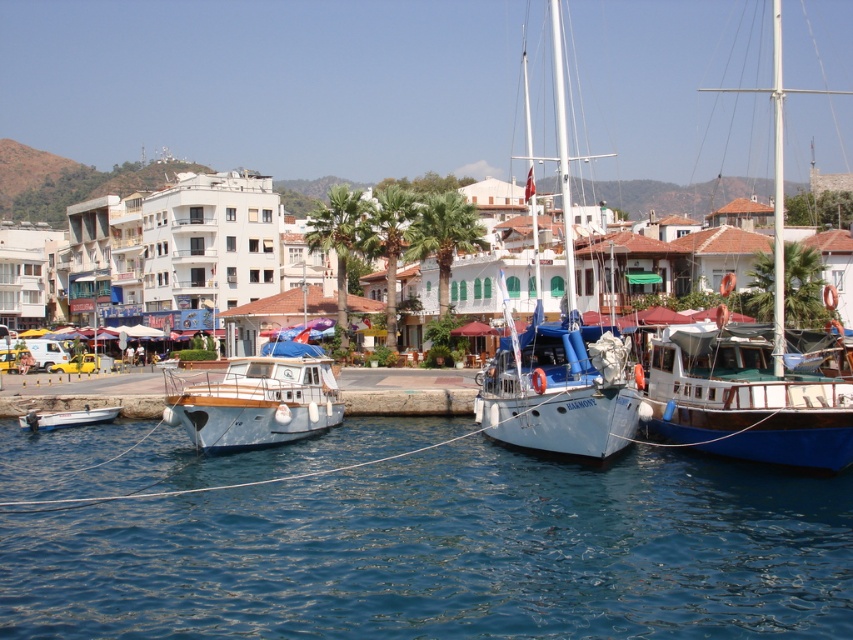
You are a dock worker who needs to move the white wooden boat at right and the matte blue wooden boat at center to a different dock. Based on their sizes, which boat would require more space during the relocation process?

The matte blue wooden boat at center requires more space during relocation because it occupies more space than the white wooden boat at right.

You are a photographer planning to take a photo of the blue polished wood sailboat at center and the white glossy sailboat at center from the pier. Which boat should you position yourself closer to if you want to capture both boats in the frame without moving the camera? Explain your reasoning.

You should position yourself closer to the white glossy sailboat at center because the blue polished wood sailboat at center is taller than the white glossy sailboat at center. By moving closer to the shorter boat, you can ensure both boats fit within the camera frame without needing to adjust the camera position.